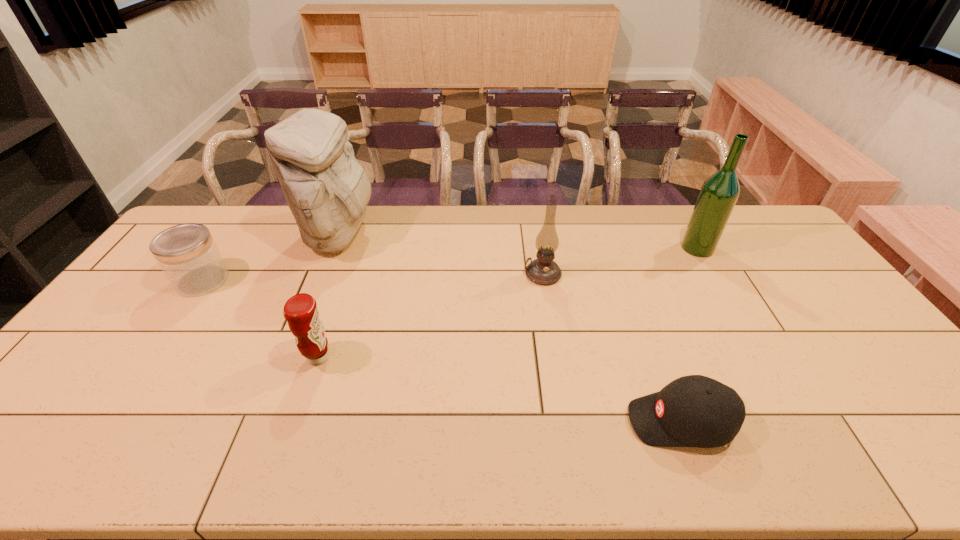
Locate an element on the screen. This screenshot has width=960, height=540. free point between the jar and the fourth object from left to right is located at coordinates (372, 277).

The height and width of the screenshot is (540, 960). What are the coordinates of `empty space that is in between the baseball cap and the backpack` in the screenshot? It's located at (x=510, y=328).

This screenshot has width=960, height=540. In order to click on free space between the third shortest object and the backpack in this screenshot , I will do `click(329, 296)`.

Locate an element on the screen. vacant area that lies between the rightmost object and the fourth tallest object is located at coordinates (508, 302).

I want to click on empty location between the backpack and the second shortest object, so click(271, 258).

Select which object is the fourth closest to the condiment. Please provide its 2D coordinates. Your answer should be formatted as a tuple, i.e. [(x, y)], where the tuple contains the x and y coordinates of a point satisfying the conditions above.

[(697, 411)]

Choose which object is the fifth nearest neighbor to the condiment. Please provide its 2D coordinates. Your answer should be formatted as a tuple, i.e. [(x, y)], where the tuple contains the x and y coordinates of a point satisfying the conditions above.

[(719, 193)]

Locate an element on the screen. Image resolution: width=960 pixels, height=540 pixels. vacant space that satisfies the following two spatial constraints: 1. on the back side of the alcohol; 2. on the front-facing side of the backpack is located at coordinates (690, 235).

This screenshot has height=540, width=960. I want to click on vacant space that satisfies the following two spatial constraints: 1. on the front side of the rightmost object; 2. with a logo on the front of the nearest object, so click(x=800, y=422).

At what (x,y) coordinates should I click in order to perform the action: click on vacant point that satisfies the following two spatial constraints: 1. on the front-facing side of the backpack; 2. on the back side of the fourth object from left to right. Please return your answer as a coordinate pair (x, y). This screenshot has width=960, height=540. Looking at the image, I should click on (324, 274).